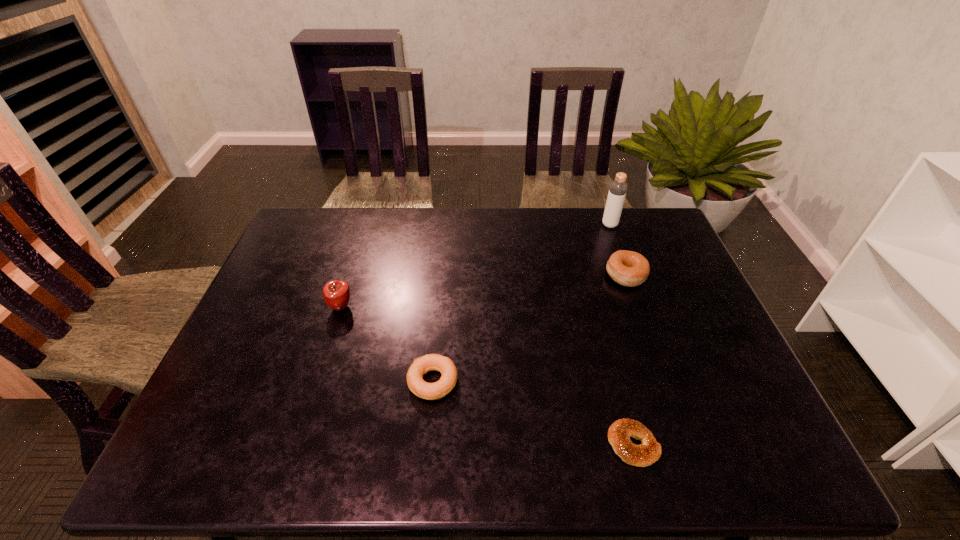
This screenshot has width=960, height=540. In order to click on vacant point located between the nearest object and the third tallest object in this screenshot , I will do click(x=630, y=360).

Locate an element on the screen. The image size is (960, 540). free space between the leftmost bagel and the shortest object is located at coordinates (533, 413).

Image resolution: width=960 pixels, height=540 pixels. I want to click on vacant region between the second shortest object and the shortest object, so click(x=533, y=413).

Identify the location of empty location between the tallest bagel and the third farthest object. (483, 291).

What are the coordinates of `vacant point located between the farthest object and the fourth farthest object` in the screenshot? It's located at (521, 303).

Where is `vacant space that's between the second tallest bagel and the tallest object`? This screenshot has width=960, height=540. vacant space that's between the second tallest bagel and the tallest object is located at coordinates (521, 303).

Locate which object is the second closest to the second nearest bagel. Please provide its 2D coordinates. Your answer should be formatted as a tuple, i.e. [(x, y)], where the tuple contains the x and y coordinates of a point satisfying the conditions above.

[(619, 433)]

Locate an element on the screen. object that can be found as the closest to the nearest object is located at coordinates (431, 362).

You are a GUI agent. You are given a task and a screenshot of the screen. Output one action in this format:
    pyautogui.click(x=<x>, y=<y>)
    Task: Click on the bagel that is the third closest to the farthest object
    The width and height of the screenshot is (960, 540).
    Given the screenshot: What is the action you would take?
    pyautogui.click(x=431, y=362)

In order to click on the third closest bagel relative to the third nearest object in this screenshot , I will do click(628, 268).